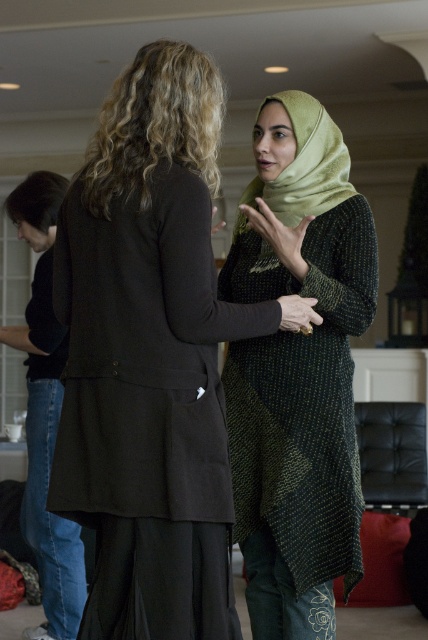
Question: Is matte black coat at center thinner than green silk hijab at center?

Choices:
 (A) no
 (B) yes

Answer: (A)

Question: Among these objects, which one is nearest to the camera?

Choices:
 (A) green silk hijab at center
 (B) green textured hijab at center
 (C) matte black coat at center

Answer: (C)

Question: Which point is closer to the camera?

Choices:
 (A) (250, 605)
 (B) (169, 604)
 (C) (299, 92)

Answer: (B)

Question: From the image, what is the correct spatial relationship of matte black coat at center in relation to green textured hijab at center?

Choices:
 (A) left
 (B) right

Answer: (A)

Question: Is matte black coat at center smaller than green textured hijab at center?

Choices:
 (A) yes
 (B) no

Answer: (B)

Question: Which point is farther to the camera?

Choices:
 (A) green textured hijab at center
 (B) matte black coat at center

Answer: (A)